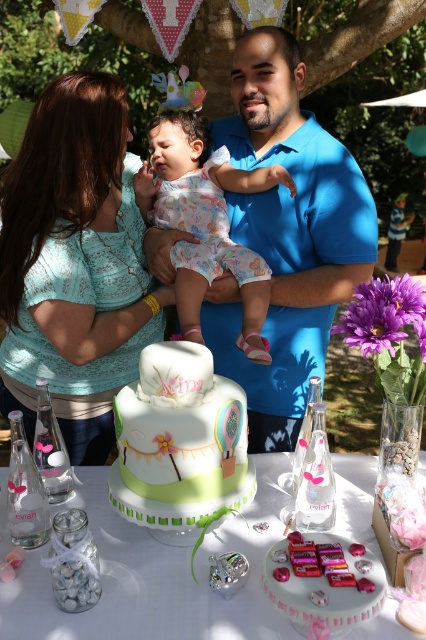
Can you confirm if white frosted cake at center is taller than pastel floral onesie at center?

In fact, white frosted cake at center may be shorter than pastel floral onesie at center.

Does white frosted cake at center appear over pastel floral onesie at center?

Incorrect, white frosted cake at center is not positioned above pastel floral onesie at center.

Who is more distant from viewer, (x=158, y=611) or (x=169, y=211)?

The point (x=169, y=211) is more distant.

You are a GUI agent. You are given a task and a screenshot of the screen. Output one action in this format:
    pyautogui.click(x=<x>, y=<y>)
    Task: Click on the white frosted cake at center
    
    Given the screenshot: What is the action you would take?
    pyautogui.click(x=155, y=576)

Can you confirm if blue cotton shirt at center is positioned to the right of pastel floral onesie at center?

Yes, blue cotton shirt at center is to the right of pastel floral onesie at center.

Does blue cotton shirt at center appear over pastel floral onesie at center?

No.

Image resolution: width=426 pixels, height=640 pixels. I want to click on blue cotton shirt at center, so click(287, 236).

Does point (23, 275) come behind point (299, 557)?

Yes, point (23, 275) is farther from viewer.

Can you confirm if matte teal blouse at upper left is taller than shiny pink cake at center?

Yes.

The image size is (426, 640). In order to click on matte teal blouse at upper left in this screenshot , I will do `click(74, 262)`.